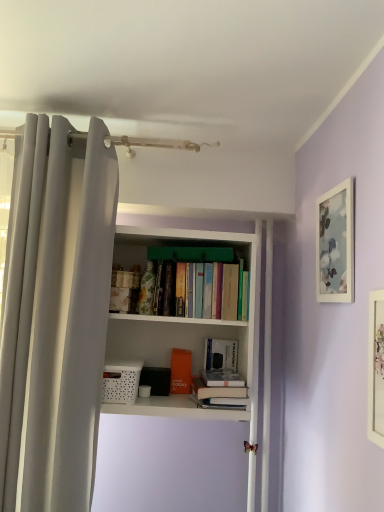
What do you see at coordinates (216, 390) in the screenshot? I see `hardcover book at center, the 1th book from the bottom` at bounding box center [216, 390].

Locate an element on the screen. Image resolution: width=384 pixels, height=512 pixels. orange matte book at center, which is counted as the third book, starting from the top is located at coordinates (180, 371).

The height and width of the screenshot is (512, 384). Describe the element at coordinates (56, 314) in the screenshot. I see `white fabric curtain at left` at that location.

I want to click on white fabric curtain at left, so click(56, 314).

You are a GUI agent. You are given a task and a screenshot of the screen. Output one action in this format:
    pyautogui.click(x=<x>, y=<y>)
    Task: Click on the hardcover book at center, marked as the 4th book in a top-to-bottom arrangement
    The height and width of the screenshot is (512, 384).
    Given the screenshot: What is the action you would take?
    pyautogui.click(x=216, y=390)

Considering the positions of points (200, 298) and (335, 266), is point (200, 298) farther from camera compared to point (335, 266)?

Yes, it is behind point (335, 266).

Which of these two, hardcover books at center, which is the fourth book from bottom to top, or white matte picture frame at upper right, the second picture frame positioned from the front, is wider?

hardcover books at center, which is the fourth book from bottom to top, is wider.

Is hardcover books at center, which is the fourth book from bottom to top, positioned with its back to white matte picture frame at upper right, the second picture frame positioned from the front?

No, hardcover books at center, which is the fourth book from bottom to top, is not facing the opposite direction of white matte picture frame at upper right, the second picture frame positioned from the front.

Is white matte book at center, which ranks as the 3th book in bottom-to-top order, at the back of white matte bookcase at center?

Correct, white matte bookcase at center is looking away from white matte book at center, which ranks as the 3th book in bottom-to-top order.

Between white matte bookcase at center and white matte book at center, which ranks as the 3th book in bottom-to-top order, which one appears on the right side from the viewer's perspective?

white matte book at center, which ranks as the 3th book in bottom-to-top order.

From the image's perspective, who appears lower, white matte bookcase at center or white matte book at center, acting as the 2th book starting from the top?

white matte book at center, acting as the 2th book starting from the top, from the image's perspective.

Where is `the 4th book behind the white matte picture frame at upper right, acting as the first picture frame starting from the back`? This screenshot has height=512, width=384. the 4th book behind the white matte picture frame at upper right, acting as the first picture frame starting from the back is located at coordinates (180, 371).

Relative to orange matte book at center, which is counted as the third book, starting from the top, is white matte picture frame at upper right, acting as the first picture frame starting from the back, in front or behind?

Visually, white matte picture frame at upper right, acting as the first picture frame starting from the back, is located in front of orange matte book at center, which is counted as the third book, starting from the top.

Can you confirm if white matte picture frame at upper right, the second picture frame positioned from the front, is positioned to the right of orange matte book at center, which is counted as the third book, starting from the top?

Correct, you'll find white matte picture frame at upper right, the second picture frame positioned from the front, to the right of orange matte book at center, which is counted as the third book, starting from the top.

Is point (349, 198) positioned behind point (179, 367)?

No, (349, 198) is in front of (179, 367).

Where is `the 3rd book to the left when counting from the matte white picture frame at right, the 1th picture frame positioned from the front`? the 3rd book to the left when counting from the matte white picture frame at right, the 1th picture frame positioned from the front is located at coordinates (200, 281).

Consider the image. Is hardcover books at center, positioned as the first book in top-to-bottom order, positioned with its back to matte white picture frame at right, the second picture frame in the back-to-front sequence?

No, hardcover books at center, positioned as the first book in top-to-bottom order, is not facing away from matte white picture frame at right, the second picture frame in the back-to-front sequence.

Relative to matte white picture frame at right, the second picture frame in the back-to-front sequence, is hardcover books at center, positioned as the first book in top-to-bottom order, in front or behind?

hardcover books at center, positioned as the first book in top-to-bottom order, is behind matte white picture frame at right, the second picture frame in the back-to-front sequence.

How distant is white matte book at center, which ranks as the 3th book in bottom-to-top order, from white fabric curtain at left?

The distance of white matte book at center, which ranks as the 3th book in bottom-to-top order, from white fabric curtain at left is 26.21 inches.

Starting from the white fabric curtain at left, which book is the 3rd one behind? Please provide its 2D coordinates.

[(220, 354)]

Is white matte book at center, acting as the 2th book starting from the top, not near white fabric curtain at left?

No.

Which object is thinner, white matte book at center, which ranks as the 3th book in bottom-to-top order, or white fabric curtain at left?

white matte book at center, which ranks as the 3th book in bottom-to-top order, is thinner.

Based on the photo, from the image's perspective, between white matte bookcase at center and hardcover books at center, positioned as the first book in top-to-bottom order, which one is located above?

hardcover books at center, positioned as the first book in top-to-bottom order, appears higher in the image.

From a real-world perspective, is white matte bookcase at center above or below hardcover books at center, which is the fourth book from bottom to top?

Clearly, from a real-world perspective, white matte bookcase at center is below hardcover books at center, which is the fourth book from bottom to top.

Which is nearer, (241,238) or (210,315)?

The point (210,315) is in front.

Between white matte bookcase at center and white matte picture frame at upper right, acting as the first picture frame starting from the back, which one has less height?

With less height is white matte picture frame at upper right, acting as the first picture frame starting from the back.

Is point (170, 325) positioned before point (353, 286)?

No, (170, 325) is behind (353, 286).

Is white matte bookcase at center facing away from white matte picture frame at upper right, acting as the first picture frame starting from the back?

No, white matte picture frame at upper right, acting as the first picture frame starting from the back, is not at the back of white matte bookcase at center.

From the image's perspective, between white matte bookcase at center and white matte picture frame at upper right, the second picture frame positioned from the front, which one is located above?

From the image's view, white matte picture frame at upper right, the second picture frame positioned from the front, is above.

You are a GUI agent. You are given a task and a screenshot of the screen. Output one action in this format:
    pyautogui.click(x=<x>, y=<y>)
    Task: Click on the picture frame above the hardcover books at center, positioned as the first book in top-to-bottom order (from the image's perspective)
    
    Given the screenshot: What is the action you would take?
    pyautogui.click(x=335, y=244)

At what (x,y) coordinates should I click in order to perform the action: click on bookcase in front of the white matte book at center, which ranks as the 3th book in bottom-to-top order. Please return your answer as a coordinate pair (x, y). This screenshot has height=512, width=384. Looking at the image, I should click on (181, 328).

Looking at the image, which one is located closer to orange matte book at center, placed as the second book when sorted from bottom to top, hardcover books at center, which is the fourth book from bottom to top, or white matte picture frame at upper right, the second picture frame positioned from the front?

hardcover books at center, which is the fourth book from bottom to top, is positioned closer to the anchor orange matte book at center, placed as the second book when sorted from bottom to top.

Considering their positions, is white fabric curtain at left positioned further to matte white picture frame at right, the second picture frame in the back-to-front sequence, than white matte picture frame at upper right, acting as the first picture frame starting from the back?

Among the two, white fabric curtain at left is located further to matte white picture frame at right, the second picture frame in the back-to-front sequence.

Based on their spatial positions, is white matte picture frame at upper right, acting as the first picture frame starting from the back, or white fabric curtain at left closer to white matte bookcase at center?

white fabric curtain at left lies closer to white matte bookcase at center than the other object.

From the image, which object appears to be farther from white matte book at center, acting as the 2th book starting from the top, orange matte book at center, which is counted as the third book, starting from the top, or matte white picture frame at right, the second picture frame in the back-to-front sequence?

Based on the image, matte white picture frame at right, the second picture frame in the back-to-front sequence, appears to be further to white matte book at center, acting as the 2th book starting from the top.

Estimate the real-world distances between objects in this image. Which object is closer to white matte book at center, which ranks as the 3th book in bottom-to-top order, hardcover books at center, positioned as the first book in top-to-bottom order, or white fabric curtain at left?

The object closer to white matte book at center, which ranks as the 3th book in bottom-to-top order, is hardcover books at center, positioned as the first book in top-to-bottom order.

Estimate the real-world distances between objects in this image. Which object is closer to hardcover books at center, positioned as the first book in top-to-bottom order, white matte bookcase at center or white matte book at center, which ranks as the 3th book in bottom-to-top order?

The object closer to hardcover books at center, positioned as the first book in top-to-bottom order, is white matte bookcase at center.

Estimate the real-world distances between objects in this image. Which object is closer to white fabric curtain at left, white matte picture frame at upper right, acting as the first picture frame starting from the back, or white matte book at center, which ranks as the 3th book in bottom-to-top order?

Among the two, white matte book at center, which ranks as the 3th book in bottom-to-top order, is located nearer to white fabric curtain at left.

Considering their positions, is hardcover book at center, the 1th book from the bottom, positioned further to hardcover books at center, positioned as the first book in top-to-bottom order, than white matte book at center, which ranks as the 3th book in bottom-to-top order?

hardcover book at center, the 1th book from the bottom, lies further to hardcover books at center, positioned as the first book in top-to-bottom order, than the other object.

Image resolution: width=384 pixels, height=512 pixels. What are the coordinates of `picture frame situated between white fabric curtain at left and matte white picture frame at right, the 1th picture frame positioned from the front, from left to right` in the screenshot? It's located at point(335,244).

At what (x,y) coordinates should I click in order to perform the action: click on picture frame between matte white picture frame at right, the second picture frame in the back-to-front sequence, and hardcover books at center, which is the fourth book from bottom to top, from front to back. Please return your answer as a coordinate pair (x, y). The width and height of the screenshot is (384, 512). Looking at the image, I should click on (335, 244).

Image resolution: width=384 pixels, height=512 pixels. Identify the location of bookcase between white fabric curtain at left and matte white picture frame at right, the 1th picture frame positioned from the front, from left to right. (181, 328).

The image size is (384, 512). In order to click on bookcase between hardcover books at center, positioned as the first book in top-to-bottom order, and hardcover book at center, marked as the 4th book in a top-to-bottom arrangement, from top to bottom in this screenshot , I will do `click(181, 328)`.